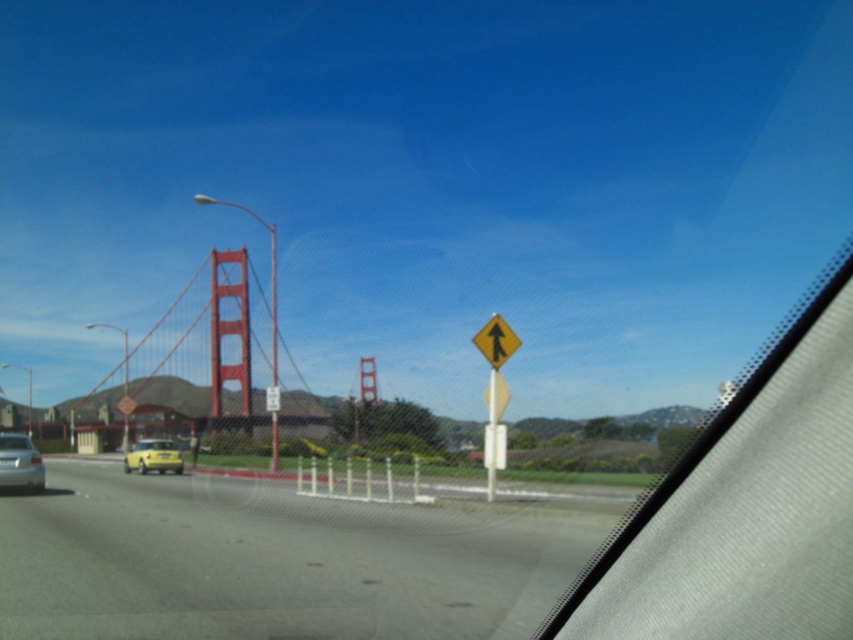
You are sitting in the driver seat of the vehicle in the scene. You need to check if the silver metallic car at lower left is located at the coordinate point of 0.725 on the x axis and 0.025 on the y axis. Is that correct?

Yes, the silver metallic car at lower left is located at point (20, 464).

In the scene shown: You are sitting in the driver seat of the car in the image. You see two points marked on the windshield. The first point is at coordinate point (32, 483) and the second point is at coordinate point (131, 456). Which point is closer to you?

Point (32, 483) is in front of point (131, 456), so it is closer to you.